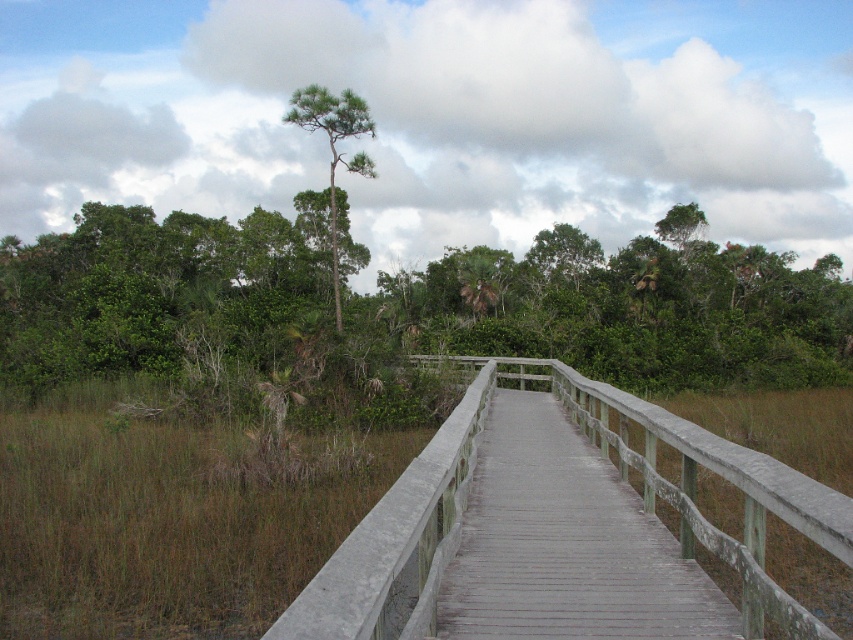
Is gray wooden bridge at center above green textured tree at upper center?

Incorrect, gray wooden bridge at center is not positioned above green textured tree at upper center.

Does gray wooden bridge at center have a lesser width compared to green textured tree at upper center?

Yes.

What do you see at coordinates (619, 477) in the screenshot? I see `gray wooden bridge at center` at bounding box center [619, 477].

The image size is (853, 640). I want to click on gray wooden bridge at center, so click(619, 477).

Which is more to the left, gray wooden boardwalk at center or green textured tree at upper center?

green textured tree at upper center is more to the left.

Based on the photo, is gray wooden boardwalk at center bigger than green textured tree at upper center?

No, gray wooden boardwalk at center is not bigger than green textured tree at upper center.

Between point (608, 483) and point (318, 109), which one is positioned behind?

The point (318, 109) is more distant.

I want to click on gray wooden boardwalk at center, so click(566, 544).

Does gray wooden bridge at center lie behind gray wooden boardwalk at center?

No, gray wooden bridge at center is in front of gray wooden boardwalk at center.

The width and height of the screenshot is (853, 640). What do you see at coordinates (619, 477) in the screenshot?
I see `gray wooden bridge at center` at bounding box center [619, 477].

Is point (549, 376) positioned before point (715, 593)?

No, it is not.

Identify the location of gray wooden bridge at center. (x=619, y=477).